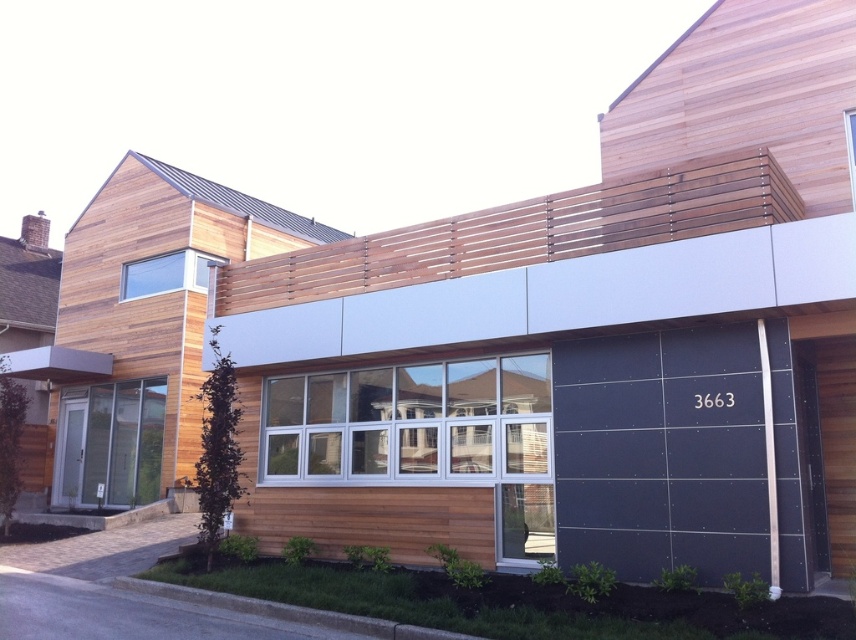
You are a delivery person trying to locate the garage door for a package delivery. The building has a modern design with wood paneling and white panels. You see a point marked at coordinates (663, 452). Based on the description, which object is located at this point?

The point at (663, 452) marks the dark gray matte or glossy garage door at lower right.